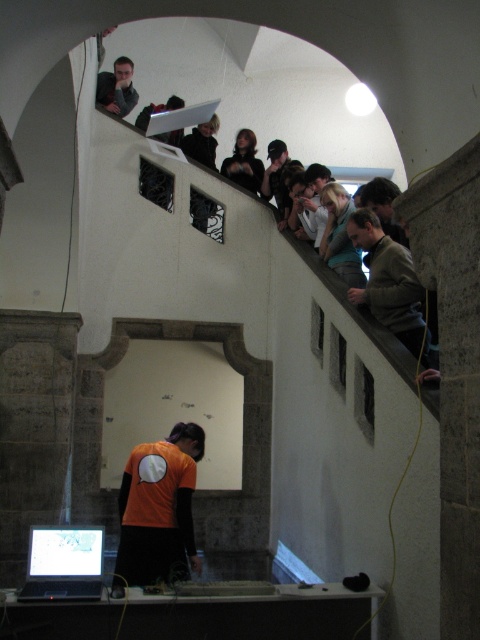
You are standing at the center of the balcony and see the point at coordinates point (63, 564). Which object is this point located on?

The point (63, 564) is on the matte black laptop at lower left.

You are an event coordinator trying to set up a presentation. You need to place a projector above the laptop to avoid blocking the screen. Is there enough vertical space between the dark gray sweater at upper right and the matte black laptop at lower left for the projector?

The dark gray sweater at upper right is above the matte black laptop at lower left, so there is vertical space between them. The projector can be placed above the laptop between the sweater and the laptop.

You are a technician who needs to locate the matte black laptop at lower left in the image. According to the coordinates provided, where exactly is it positioned?

The matte black laptop at lower left is positioned at point 0.883 on the x axis and 0.133 on the y axis.